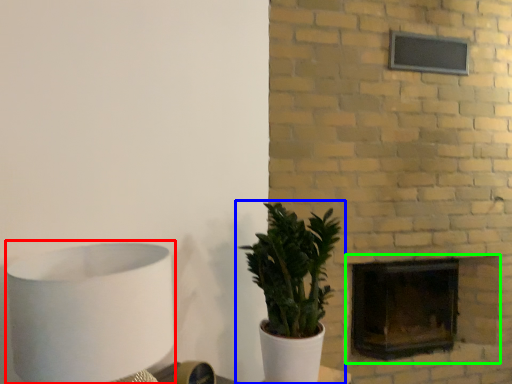
Question: Which object is the closest to the table lamp (highlighted by a red box)? Choose among these: houseplant (highlighted by a blue box) or fireplace (highlighted by a green box).

Choices:
 (A) houseplant
 (B) fireplace

Answer: (A)